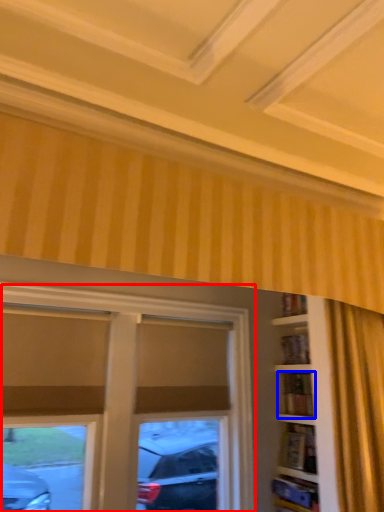
Question: Which point is further to the camera, window (highlighted by a red box) or shelf (highlighted by a blue box)?

Choices:
 (A) window
 (B) shelf

Answer: (B)